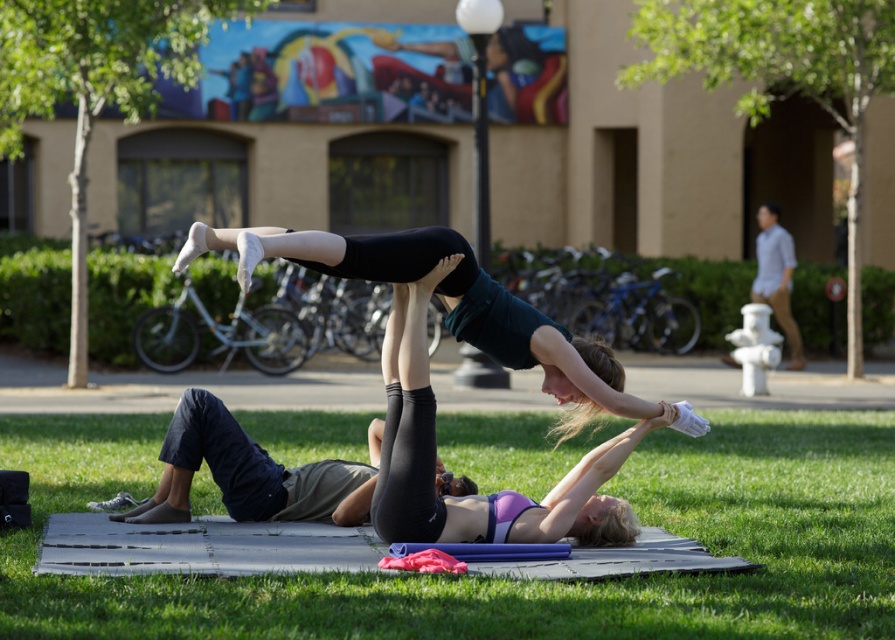
You are a photographer trying to capture the black matte yoga pose at center and the green grass at lower center in a single frame. Based on their positions, which object should you adjust your camera angle to focus on first to ensure both are in the shot?

The green grass at lower center is positioned on the left side of black matte yoga pose at center, so you should first focus on the black matte yoga pose at center to ensure both it and the green grass at lower center are included in the frame.

You are a photographer standing at the edge of the green grass at lower center, aiming to capture the black matte yoga pose at center in your shot. Given that your camera has a minimum focusing distance of 10 feet, will you be able to take a clear photo without moving closer?

The distance between the green grass at lower center and the black matte yoga pose at center is 12.18 feet, which is beyond the camera minimum focusing distance of 10 feet. Therefore, you can take a clear photo without moving closer.

Consider the image. You are a photographer positioned at the edge of the grassy area where the yoga practice is happening. You want to capture a photo that includes both the green grass at lower center and the matte black leggings at center. Based on their positions, which object should you adjust your camera angle to focus on first to ensure both are in frame?

The green grass at lower center is to the left of matte black leggings at center, so you should adjust your camera angle to focus on the green grass at lower center first to ensure both are in frame.